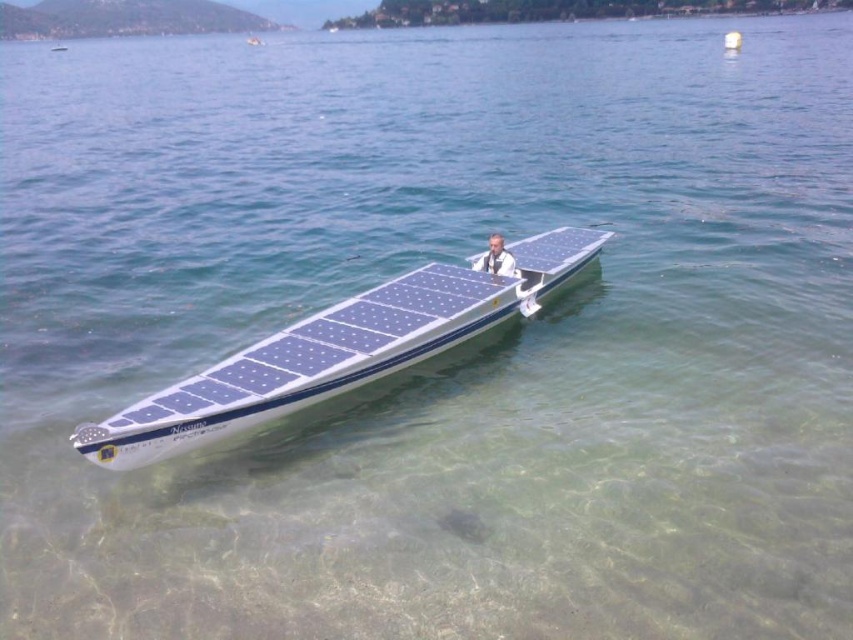
Question: Does blue solar panel boat at center lie behind light brown leather jacket at center?

Choices:
 (A) yes
 (B) no

Answer: (B)

Question: Which object appears farthest from the camera in this image?

Choices:
 (A) blue solar panel boat at center
 (B) light brown leather jacket at center

Answer: (B)

Question: Is blue solar panel boat at center wider than light brown leather jacket at center?

Choices:
 (A) yes
 (B) no

Answer: (A)

Question: Can you confirm if blue solar panel boat at center is positioned to the right of light brown leather jacket at center?

Choices:
 (A) no
 (B) yes

Answer: (A)

Question: Which point is farther to the camera?

Choices:
 (A) pyautogui.click(x=498, y=272)
 (B) pyautogui.click(x=140, y=417)

Answer: (A)